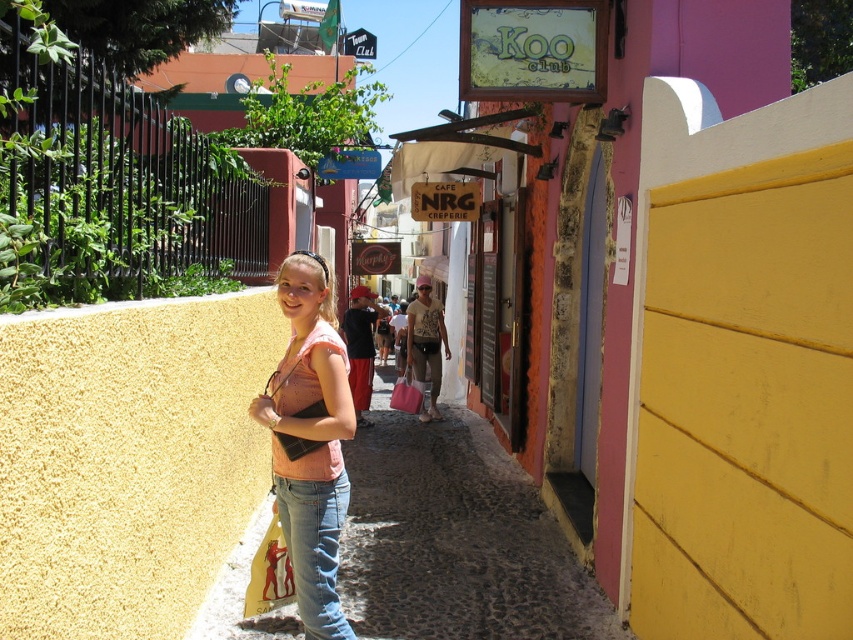
Is pink matte shirt at center to the left of yellow fabric shopping bag at center from the viewer's perspective?

No, pink matte shirt at center is not to the left of yellow fabric shopping bag at center.

Consider the image. Is pink matte shirt at center wider than yellow fabric shopping bag at center?

Yes.

Does point (299, 301) come in front of point (248, 592)?

Yes, point (299, 301) is in front of point (248, 592).

Locate an element on the screen. This screenshot has height=640, width=853. pink matte shirt at center is located at coordinates (310, 440).

Who is higher up, pink fabric vest at center or pink fabric shopping bag at center?

pink fabric vest at center is above.

Is point (302, 378) closer to viewer compared to point (408, 381)?

Yes.

Is point (311, 376) positioned behind point (416, 403)?

No, (311, 376) is in front of (416, 403).

Image resolution: width=853 pixels, height=640 pixels. Find the location of `pink fabric vest at center`. pink fabric vest at center is located at coordinates (302, 371).

Based on the photo, is pink matte shirt at center further to the viewer compared to denim jeans at center?

No, it is in front of denim jeans at center.

At what (x,y) coordinates should I click in order to perform the action: click on pink matte shirt at center. Please return your answer as a coordinate pair (x, y). Looking at the image, I should click on (310, 440).

Is point (280, 269) farther from viewer compared to point (306, 577)?

Yes.

In order to click on pink matte shirt at center in this screenshot , I will do `click(310, 440)`.